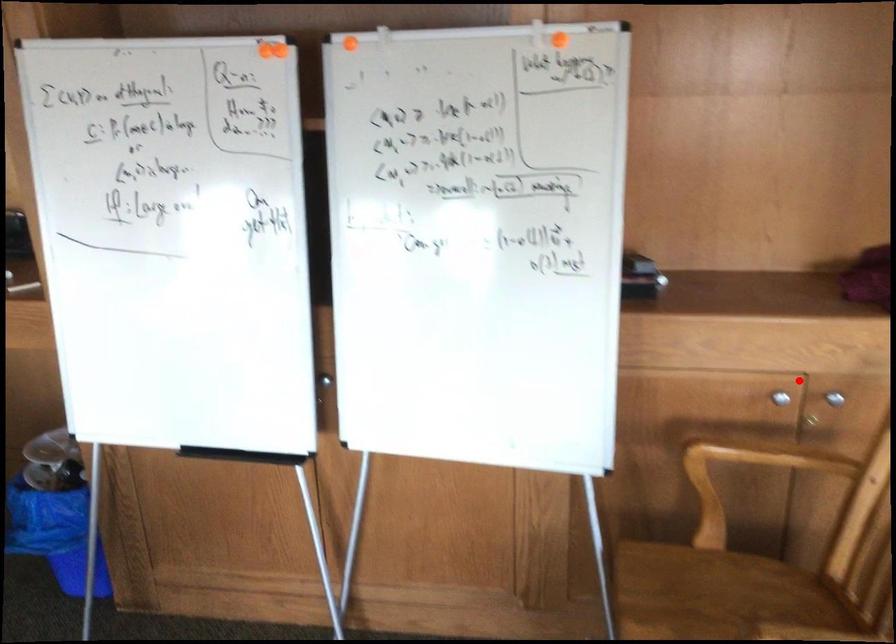
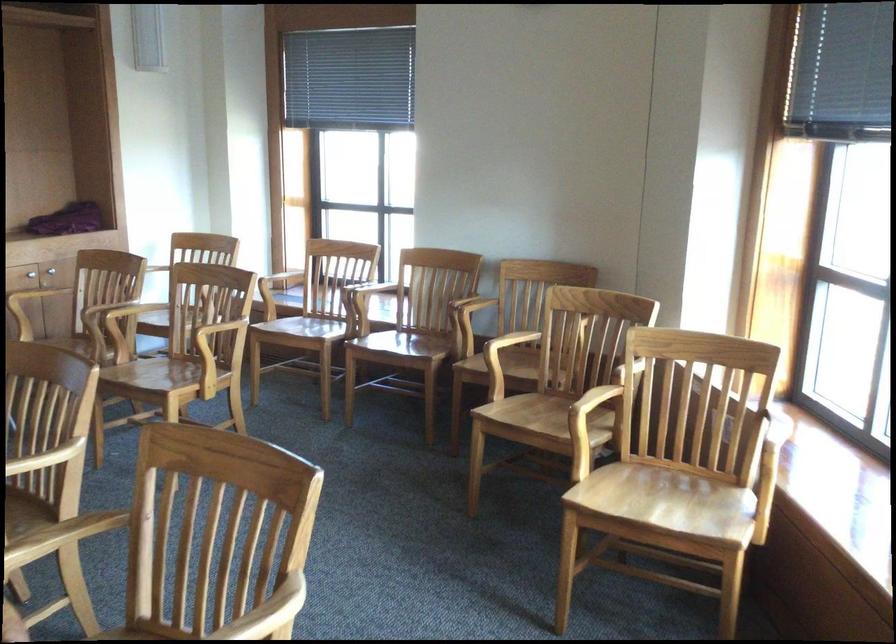
Question: I am providing you with two images of the same scene from different viewpoints. A red point is marked on the first image. Can you still see the location of the red point in image 2?

Choices:
 (A) Yes
 (B) No

Answer: (A)